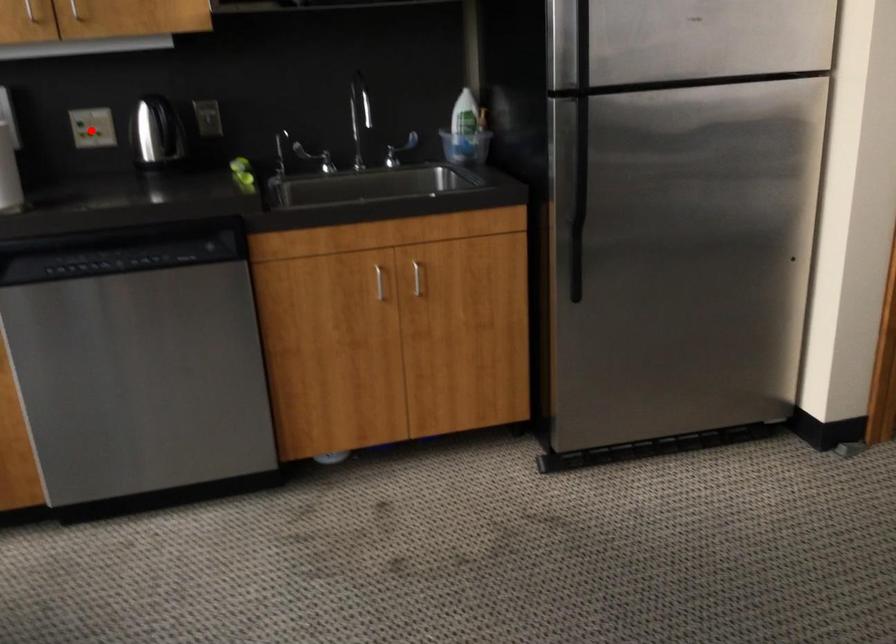
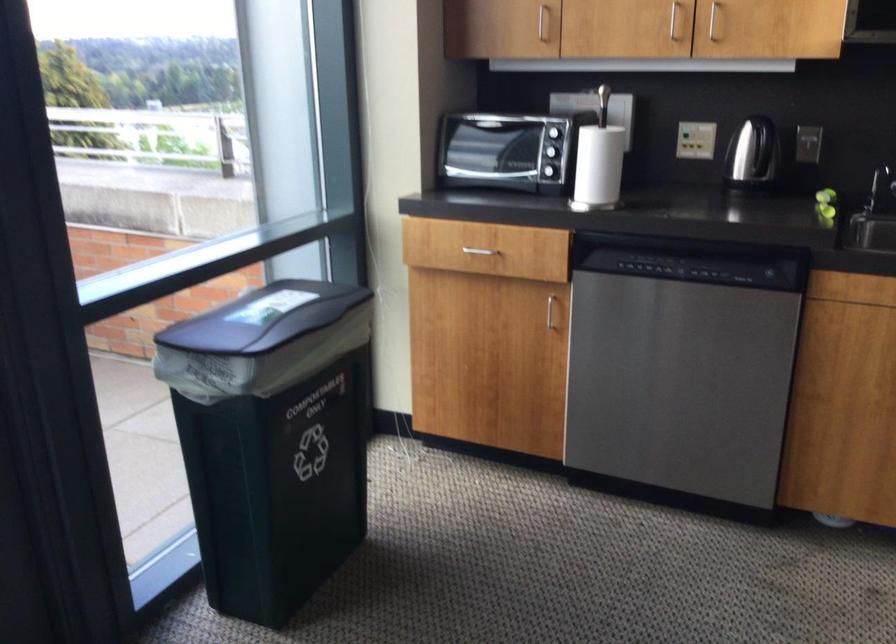
Find the pixel in the second image that matches the highlighted location in the first image.

(695, 140)